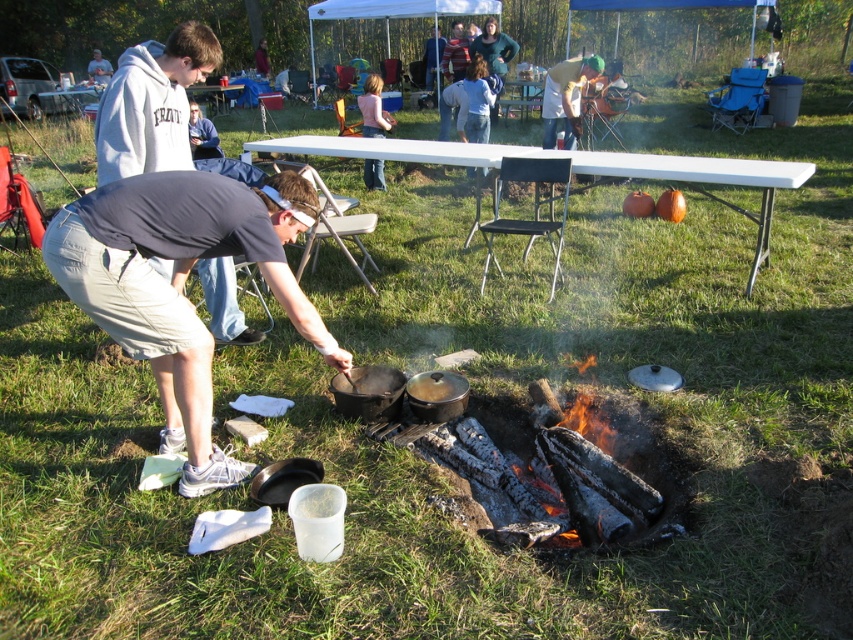
Can you confirm if gray cotton shirt at center is positioned below white plastic picnic table at upper center?

Yes.

Is point (270, 280) less distant than point (751, 214)?

Yes, it is.

Which is in front, point (117, 339) or point (329, 145)?

Point (117, 339) is in front.

What are the coordinates of `gray cotton shirt at center` in the screenshot? It's located at (181, 284).

Which is behind, point (314, 321) or point (367, 176)?

The point (367, 176) is behind.

Who is lower down, gray cotton shirt at center or pink fabric shirt at center?

gray cotton shirt at center is lower down.

Does point (105, 301) come in front of point (390, 128)?

That is True.

At what (x,y) coordinates should I click in order to perform the action: click on gray cotton shirt at center. Please return your answer as a coordinate pair (x, y). The width and height of the screenshot is (853, 640). Looking at the image, I should click on (181, 284).

Is white plastic picnic table at upper center shorter than pink fabric shirt at center?

Incorrect, white plastic picnic table at upper center's height does not fall short of pink fabric shirt at center's.

From the picture: Can you confirm if white plastic picnic table at upper center is bigger than pink fabric shirt at center?

Correct, white plastic picnic table at upper center is larger in size than pink fabric shirt at center.

Does point (759, 241) lie in front of point (376, 170)?

That is True.

I want to click on white plastic picnic table at upper center, so click(x=575, y=168).